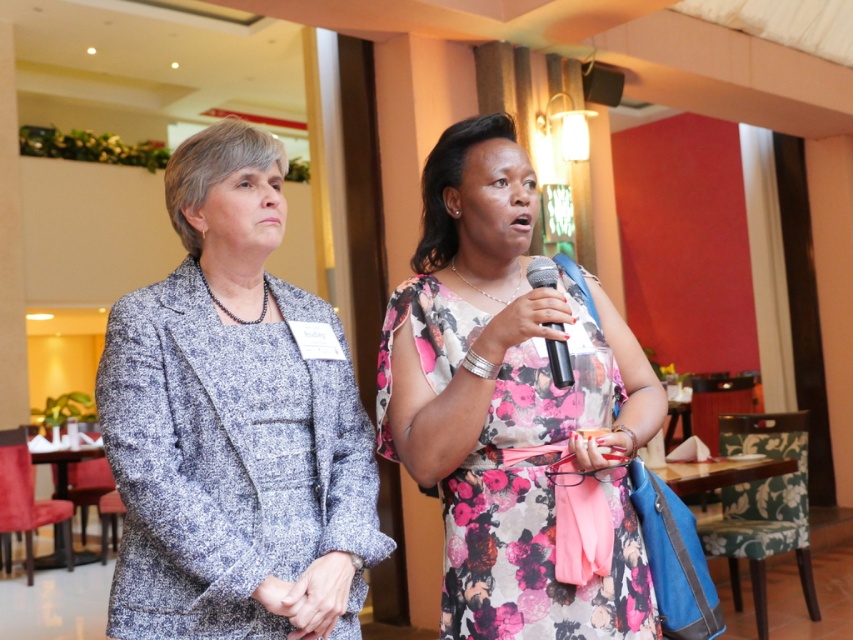
Question: Is speckled wool blazer at left above metallic silver microphone at center?

Choices:
 (A) yes
 (B) no

Answer: (B)

Question: Which of the following is the closest to the observer?

Choices:
 (A) floral dress at center
 (B) metallic silver microphone at center
 (C) speckled wool blazer at left

Answer: (C)

Question: Can you confirm if floral dress at center is positioned to the left of metallic silver microphone at center?

Choices:
 (A) no
 (B) yes

Answer: (B)

Question: Which object is closer to the camera taking this photo?

Choices:
 (A) floral dress at center
 (B) metallic silver microphone at center

Answer: (B)

Question: Which point is farther from the camera taking this photo?

Choices:
 (A) (564, 380)
 (B) (329, 509)
 (C) (422, 328)

Answer: (C)

Question: Is floral dress at center bigger than metallic silver microphone at center?

Choices:
 (A) no
 (B) yes

Answer: (B)